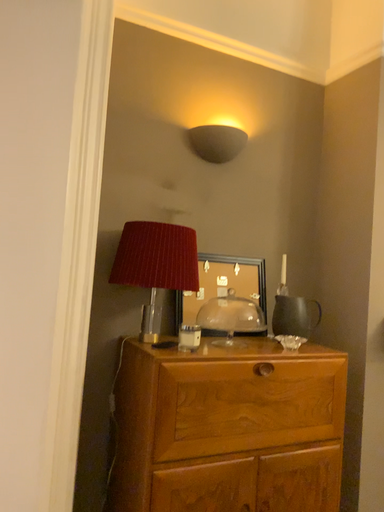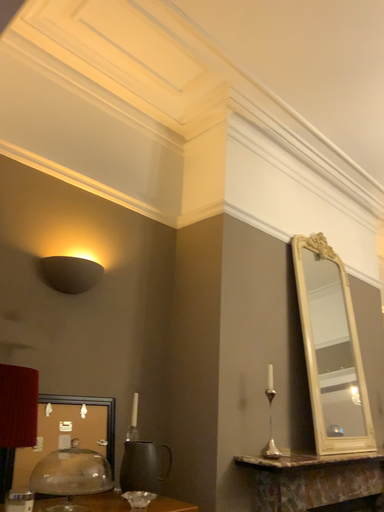
Question: Which way did the camera rotate in the video?

Choices:
 (A) rotated right
 (B) rotated left

Answer: (A)